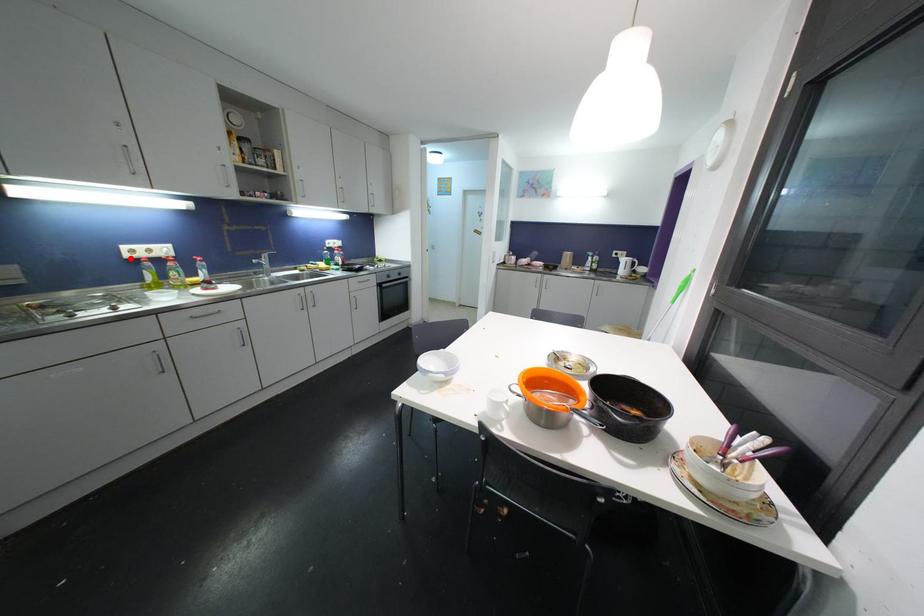
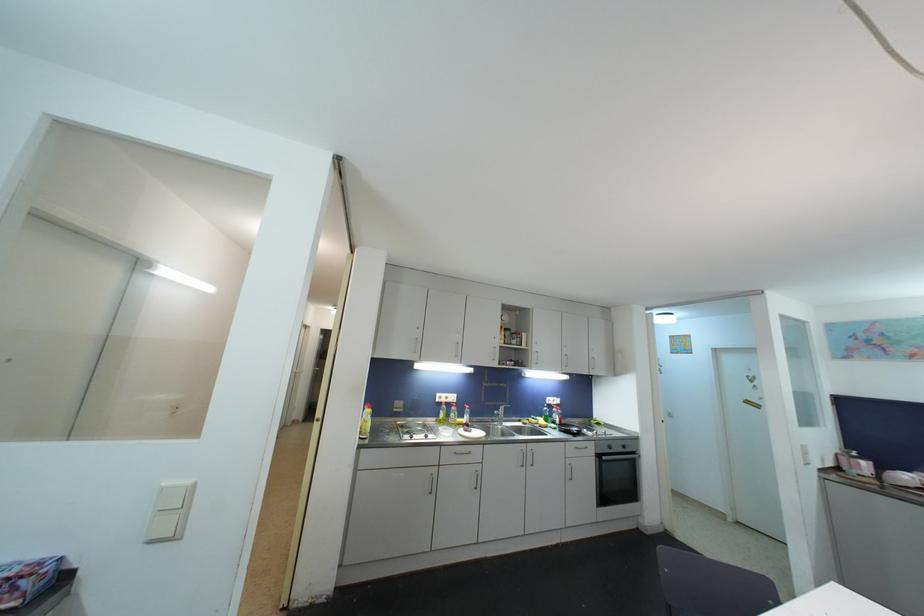
Locate, in the second image, the point that corresponds to the highlighted location in the first image.

(441, 403)